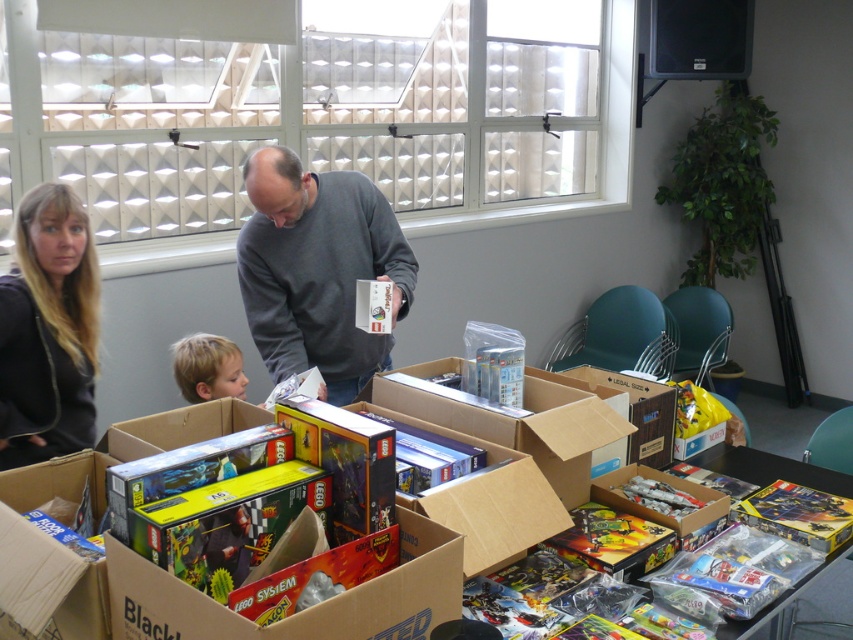
Question: Which object is closer to the camera taking this photo?

Choices:
 (A) cardboard box at center
 (B) matte black hoodie at left

Answer: (A)

Question: Among these objects, which one is nearest to the camera?

Choices:
 (A) cardboard box at center
 (B) gray matte shirt at center

Answer: (A)

Question: Estimate the real-world distances between objects in this image. Which object is closer to the matte black hoodie at left?

Choices:
 (A) metallic silver toy at center
 (B) gray matte shirt at center

Answer: (B)

Question: In this image, where is gray matte shirt at center located relative to cardboard box at center?

Choices:
 (A) left
 (B) right

Answer: (A)

Question: In this image, where is blonde hair at lower left located relative to metallic silver toy at center?

Choices:
 (A) below
 (B) above

Answer: (B)

Question: Can you confirm if blonde hair at lower left is bigger than metallic silver toy at center?

Choices:
 (A) yes
 (B) no

Answer: (A)